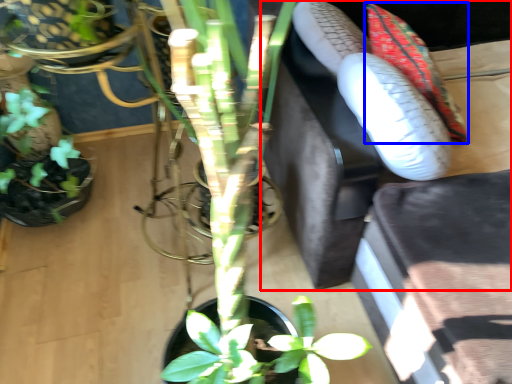
Question: Among these objects, which one is farthest to the camera, couch (highlighted by a red box) or flower (highlighted by a blue box)?

Choices:
 (A) couch
 (B) flower

Answer: (B)